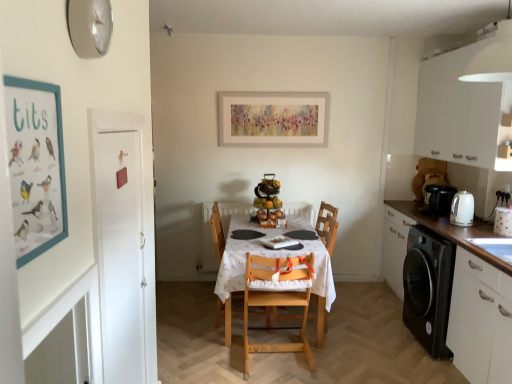
What are the coordinates of `vacant space to the right of natural wood highchair at center, positioned as the second chair in back-to-front order` in the screenshot? It's located at (344, 354).